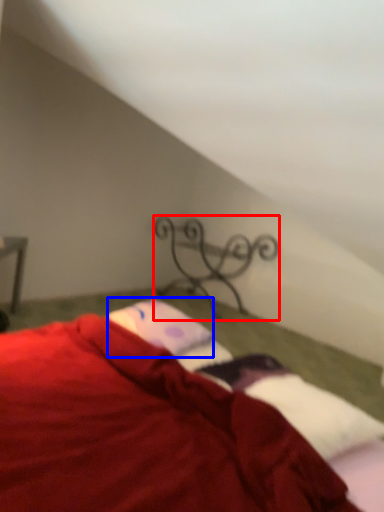
Question: Which object is closer to the camera taking this photo, design (highlighted by a red box) or pillow (highlighted by a blue box)?

Choices:
 (A) design
 (B) pillow

Answer: (B)